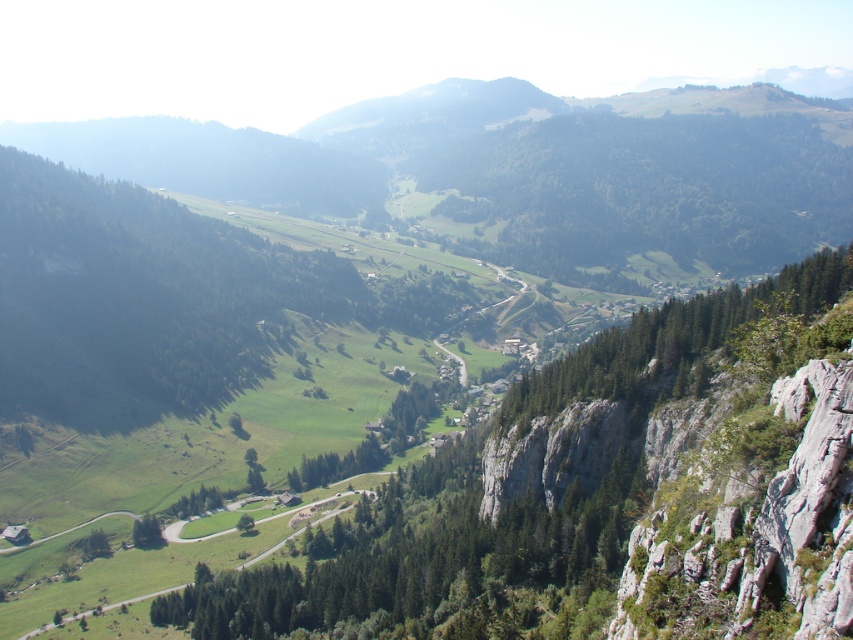
Question: Considering the relative positions of green leafy trees at center and green leafy tree at lower left in the image provided, where is green leafy trees at center located with respect to green leafy tree at lower left?

Choices:
 (A) right
 (B) left

Answer: (A)

Question: Can you confirm if green leafy trees at center is positioned to the left of green leafy tree at lower left?

Choices:
 (A) no
 (B) yes

Answer: (A)

Question: Which of the following is the closest to the observer?

Choices:
 (A) green leafy tree at lower left
 (B) green leafy trees at center

Answer: (A)

Question: Which of the following is the farthest from the observer?

Choices:
 (A) green leafy trees at center
 (B) green leafy tree at lower left

Answer: (A)

Question: Is green leafy trees at center to the left of green leafy tree at lower left from the viewer's perspective?

Choices:
 (A) no
 (B) yes

Answer: (A)